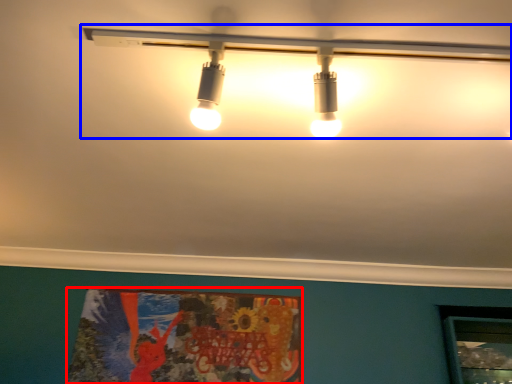
Question: Which point is further to the camera, poster page (highlighted by a red box) or lamp (highlighted by a blue box)?

Choices:
 (A) poster page
 (B) lamp

Answer: (A)